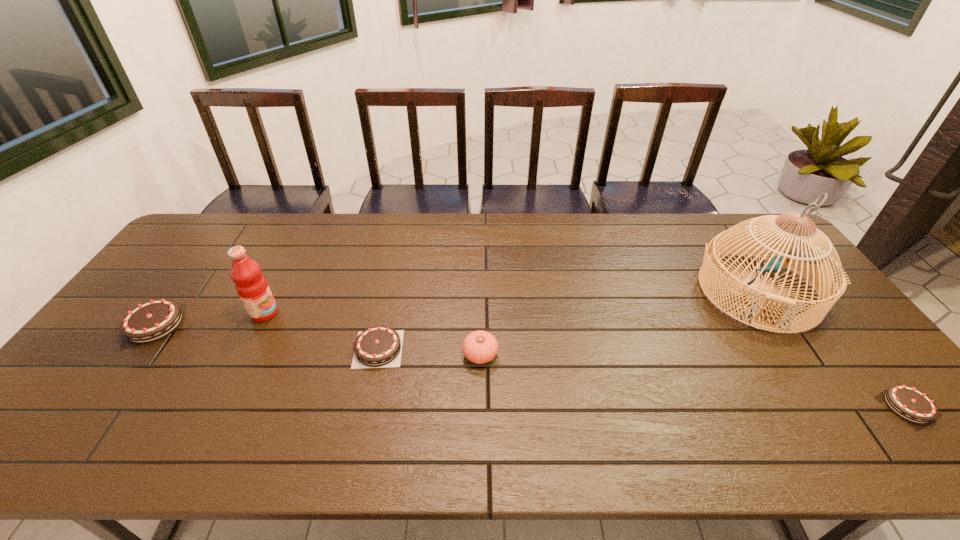
Image resolution: width=960 pixels, height=540 pixels. In order to click on the leftmost object in this screenshot , I will do `click(151, 321)`.

Locate an element on the screen. This screenshot has height=540, width=960. the third shortest object is located at coordinates (151, 321).

I want to click on the second tallest chocolate cake, so click(x=380, y=346).

In order to click on the fourth object from right to left in this screenshot , I will do `click(380, 346)`.

Find the location of `the nearest object`. the nearest object is located at coordinates (909, 403).

Where is `the shortest object`? The width and height of the screenshot is (960, 540). the shortest object is located at coordinates (909, 403).

The width and height of the screenshot is (960, 540). I want to click on the fifth object from right to left, so click(x=252, y=287).

The width and height of the screenshot is (960, 540). In order to click on the second tallest object in this screenshot , I will do `click(252, 287)`.

This screenshot has width=960, height=540. Identify the location of birdcage. (803, 250).

Where is `the third tallest object`? The image size is (960, 540). the third tallest object is located at coordinates (480, 347).